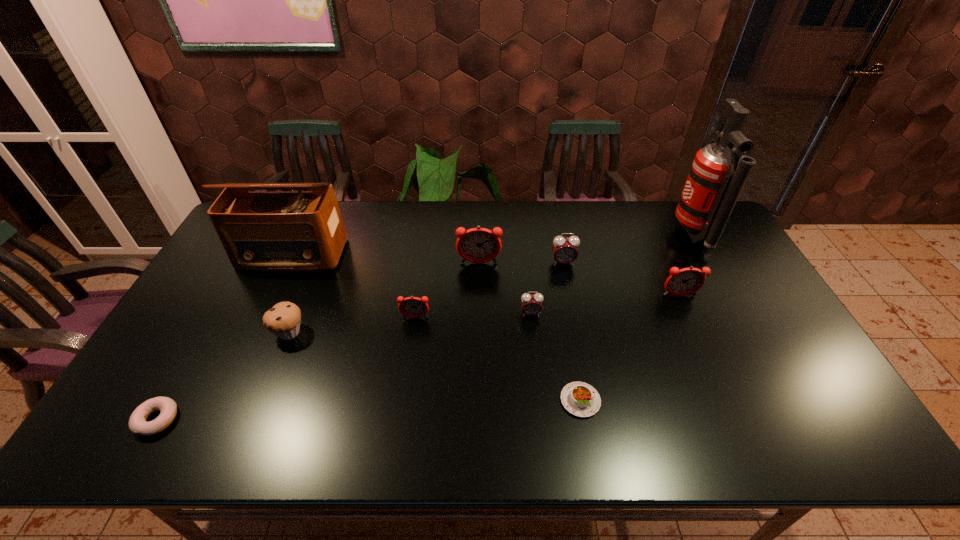
Where is `unoccupied area between the rightmost reddish-pink alarm clock and the pudding`? Image resolution: width=960 pixels, height=540 pixels. unoccupied area between the rightmost reddish-pink alarm clock and the pudding is located at coordinates (630, 348).

Locate an element on the screen. This screenshot has height=540, width=960. free spot between the doughnut and the biggest reddish-pink alarm clock is located at coordinates [x=318, y=341].

The image size is (960, 540). Find the location of `object that stands as the sixth closest to the red fire extinguisher`. object that stands as the sixth closest to the red fire extinguisher is located at coordinates (413, 307).

Where is `object that ranks as the second closest to the second tallest object`? Image resolution: width=960 pixels, height=540 pixels. object that ranks as the second closest to the second tallest object is located at coordinates (413, 307).

Find the location of a particular element. This screenshot has width=960, height=540. alarm clock object that ranks as the closest to the seventh object from right to left is located at coordinates (477, 245).

At what (x,y) coordinates should I click in order to perform the action: click on alarm clock that is the second closest to the second alarm clock from left to right. Please return your answer as a coordinate pair (x, y). Looking at the image, I should click on (531, 304).

Identify which reddish-pink alarm clock is located as the second nearest to the third nearest alarm clock. Please provide its 2D coordinates. Your answer should be formatted as a tuple, i.e. [(x, y)], where the tuple contains the x and y coordinates of a point satisfying the conditions above.

[(413, 307)]

Locate which reddish-pink alarm clock is the closest to the sixth nearest object. Please provide its 2D coordinates. Your answer should be formatted as a tuple, i.e. [(x, y)], where the tuple contains the x and y coordinates of a point satisfying the conditions above.

[(477, 245)]

Identify the location of vacant area in the image that satisfies the following two spatial constraints: 1. on the front-facing side of the third tallest object; 2. on the left side of the pudding. This screenshot has height=540, width=960. (479, 401).